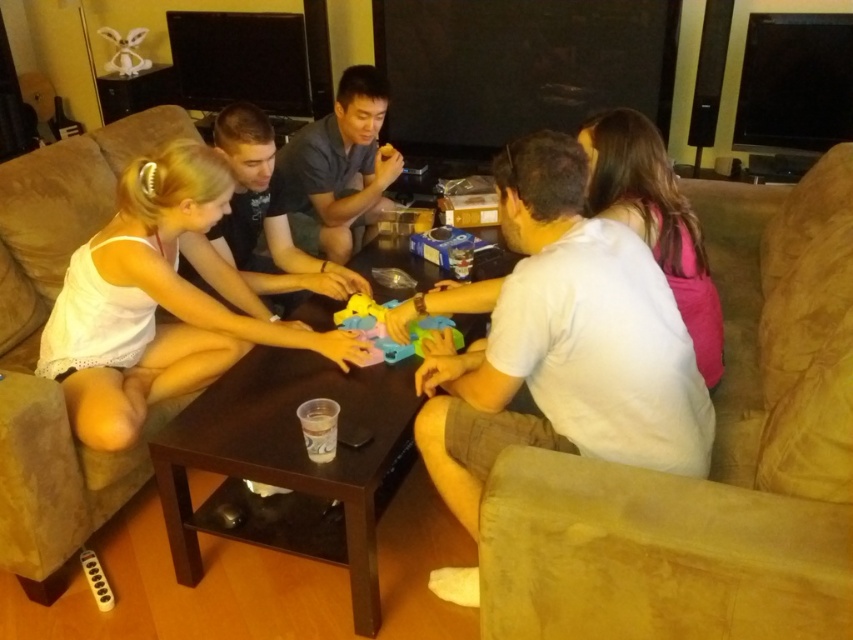
Can you confirm if suede couch at lower right is positioned to the right of white fabric dress at center?

Yes, suede couch at lower right is to the right of white fabric dress at center.

Who is more forward, (788, 577) or (103, 356)?

Point (788, 577)

Is point (846, 301) positioned after point (328, 337)?

That is False.

Image resolution: width=853 pixels, height=640 pixels. Identify the location of suede couch at lower right. (712, 464).

Between suede couch at lower right and brown wooden table at center, which one appears on the left side from the viewer's perspective?

brown wooden table at center is more to the left.

Which is below, suede couch at lower right or brown wooden table at center?

Positioned lower is brown wooden table at center.

Between point (784, 400) and point (300, 358), which one is positioned behind?

The point (300, 358) is behind.

Identify the location of suede couch at lower right. The width and height of the screenshot is (853, 640). (712, 464).

Which is more to the left, brown wooden table at center or suede couch at lower left?

From the viewer's perspective, suede couch at lower left appears more on the left side.

Where is `brown wooden table at center`? The image size is (853, 640). brown wooden table at center is located at coordinates (291, 465).

Where is `brown wooden table at center`? The image size is (853, 640). brown wooden table at center is located at coordinates (291, 465).